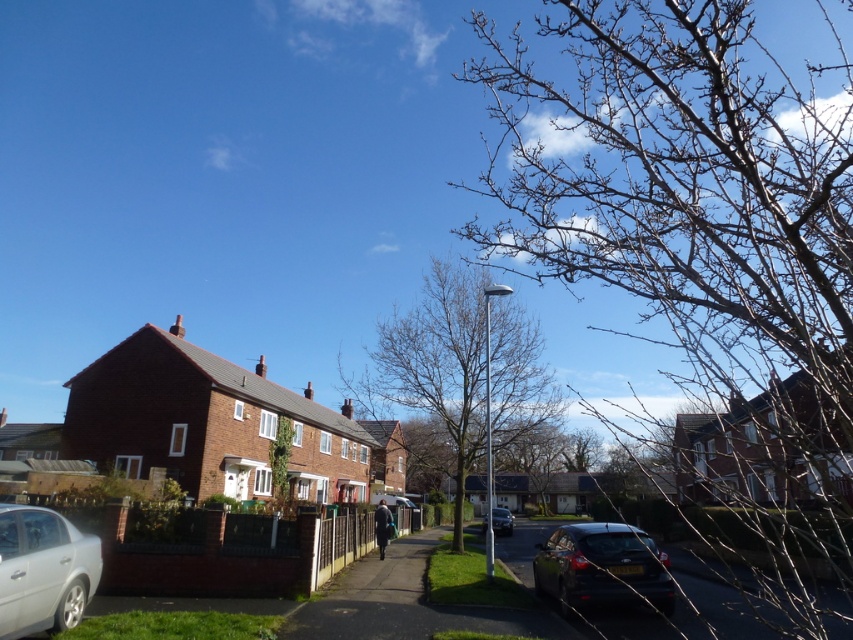
Based on the photo, you are a delivery person trying to navigate through the residential street. You see the bare branches at upper right and the shiny black car at lower right. Which object is bigger in the image?

The bare branches at upper right are larger in size than the shiny black car at lower right, so the bare branches at upper right is bigger in the image.

You are standing on the sidewalk in front of the two story brick house with a pitched roof. You want to look at the point marked as point (701, 252). Which direction should you look to see it?

The point (701, 252) is on the bare branches at upper right, so you should look towards the upper right direction to see it.

You are standing on the sidewalk in front of the two story brick house. You see two points marked on the image. The first point is at coordinates point (606,176) and the second point is at coordinates point (485,529). Which point is closer to you?

Point (606,176) is closer to the viewer than point (485,529).